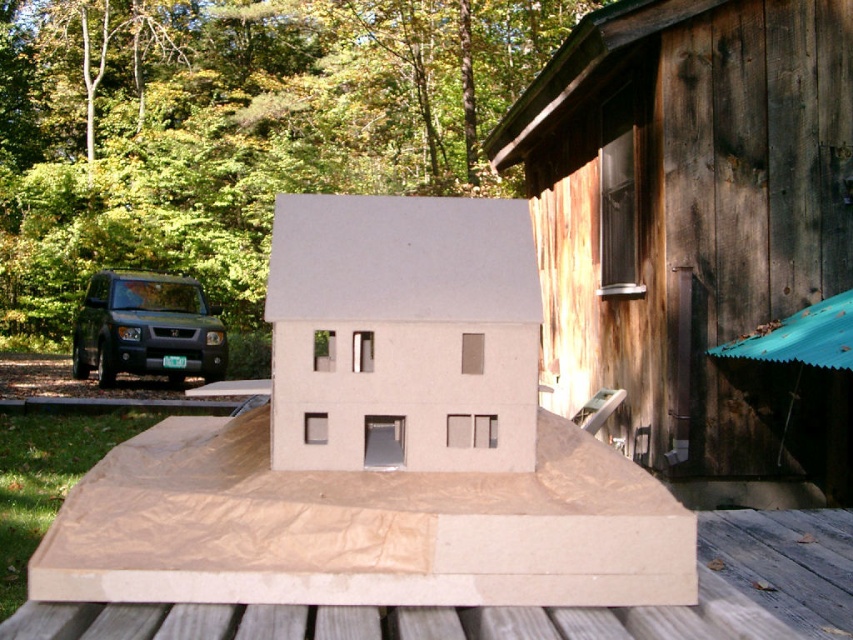
Can you confirm if weathered wood hut at right is bigger than white cardboard cabin at center?

Yes.

Does weathered wood hut at right have a lesser width compared to white cardboard cabin at center?

No, weathered wood hut at right is not thinner than white cardboard cabin at center.

Does point (625, 355) come farther from viewer compared to point (339, 308)?

That is True.

Where is `weathered wood hut at right`? weathered wood hut at right is located at coordinates (700, 236).

Is white cardboard cabin at center further to camera compared to dark green matte suv at left?

No.

Between point (432, 419) and point (113, 346), which one is positioned behind?

The point (113, 346) is more distant.

What are the coordinates of `white cardboard cabin at center` in the screenshot? It's located at (402, 333).

Can you confirm if weathered wood hut at right is taller than dark green matte suv at left?

Correct, weathered wood hut at right is much taller as dark green matte suv at left.

The width and height of the screenshot is (853, 640). What do you see at coordinates (700, 236) in the screenshot?
I see `weathered wood hut at right` at bounding box center [700, 236].

Find the location of a particular element. weathered wood hut at right is located at coordinates (700, 236).